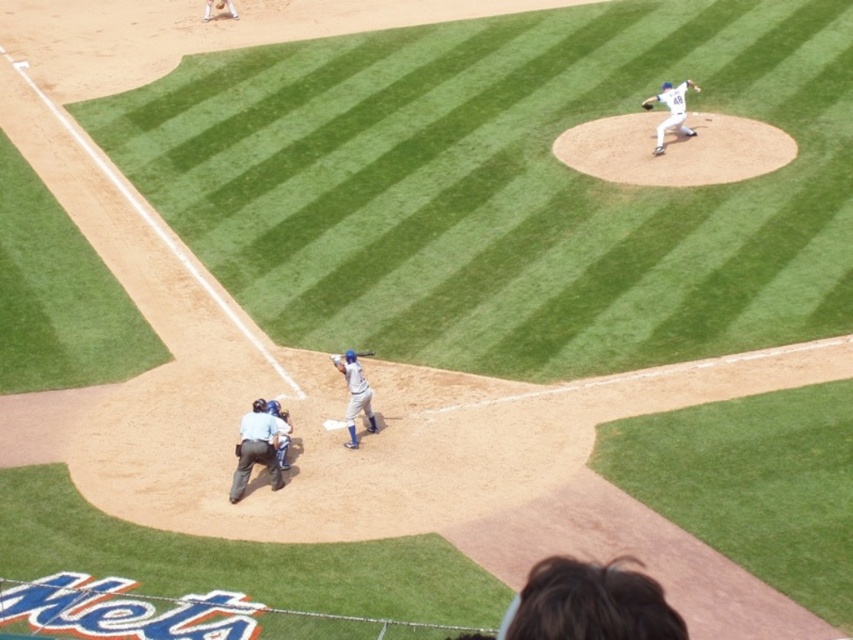
You are a spectator at the baseball game and want to know the relative positions of the matte blue bat at center and the dark brown leather glove at upper right. Which object is located to the left of the other?

The matte blue bat at center is positioned on the left side of dark brown leather glove at upper right.

You are a spectator at the baseball game and want to take a photo of both the blue fabric catcher at lower center and the dark brown leather glove at upper right. Which object should you focus on first to ensure both are in the frame?

The blue fabric catcher at lower center is located below the dark brown leather glove at upper right. To include both in your photo, focus on the dark brown leather glove at upper right first as it is higher up, then adjust the framing to include the lower positioned blue fabric catcher at lower center.